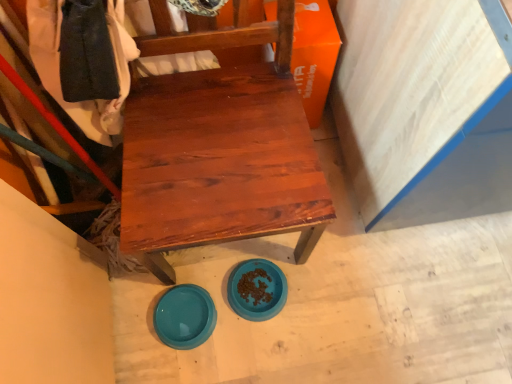
This screenshot has height=384, width=512. I want to click on free point to the right of matte wood chair at center, so click(361, 265).